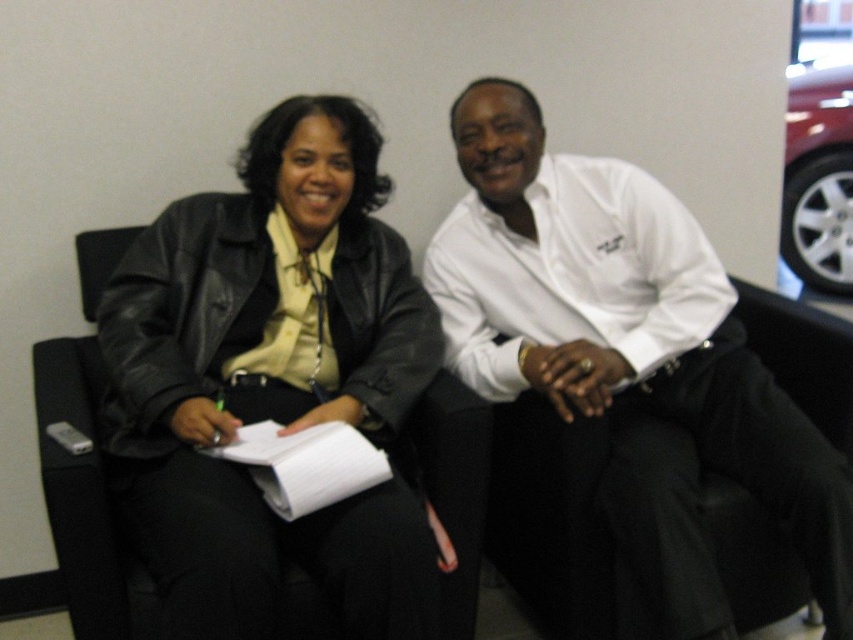
Question: Which point is closer to the camera taking this photo?

Choices:
 (A) (573, 188)
 (B) (138, 268)
 (C) (793, 140)

Answer: (B)

Question: Does black leather jacket at left have a greater width compared to shiny metallic car at upper right?

Choices:
 (A) yes
 (B) no

Answer: (A)

Question: Is black leather jacket at left positioned in front of white shirt at center?

Choices:
 (A) no
 (B) yes

Answer: (B)

Question: Which of these objects is positioned closest to the black leather jacket at left?

Choices:
 (A) white shirt at center
 (B) shiny metallic car at upper right

Answer: (A)

Question: Is white shirt at center behind shiny metallic car at upper right?

Choices:
 (A) yes
 (B) no

Answer: (B)

Question: Which point is closer to the camera?

Choices:
 (A) shiny metallic car at upper right
 (B) black leather jacket at left

Answer: (B)